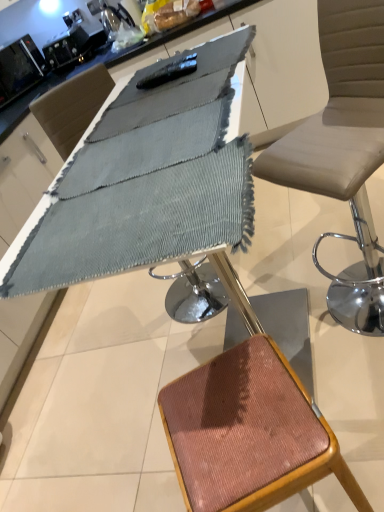
Question: From the image's perspective, is rustic wood stool at lower right located above or below black glossy microwave at upper left?

Choices:
 (A) below
 (B) above

Answer: (A)

Question: Considering the positions of rustic wood stool at lower right and black glossy microwave at upper left in the image, is rustic wood stool at lower right wider or thinner than black glossy microwave at upper left?

Choices:
 (A) thin
 (B) wide

Answer: (B)

Question: Estimate the real-world distances between objects in this image. Which object is closer to the textured gray fabric at center?

Choices:
 (A) rustic wood stool at lower right
 (B) black glossy microwave at upper left

Answer: (A)

Question: Estimate the real-world distances between objects in this image. Which object is closer to the black glossy microwave at upper left?

Choices:
 (A) rustic wood stool at lower right
 (B) textured gray fabric at center

Answer: (B)